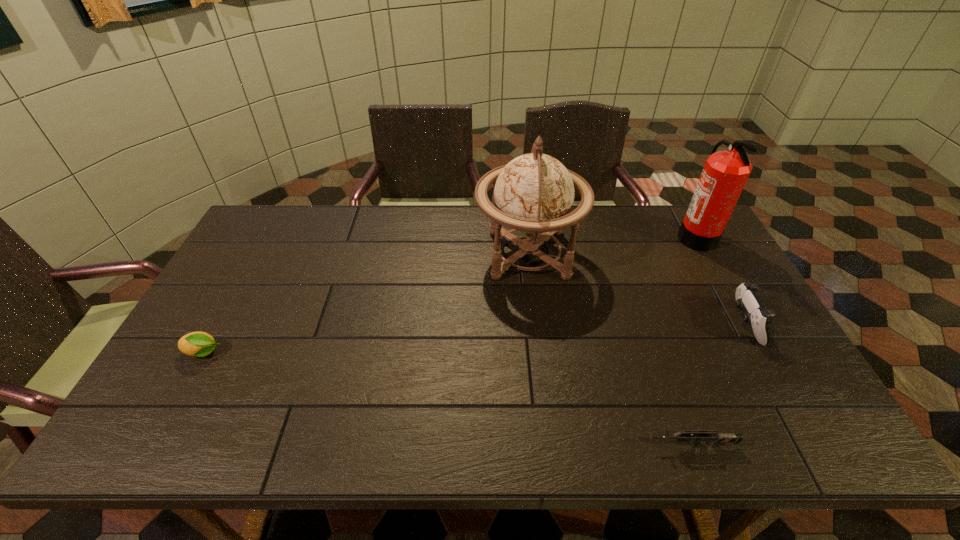
Identify the location of globe at the far edge. (534, 193).

This screenshot has width=960, height=540. Find the location of `fire extinguisher positioned at the far edge`. fire extinguisher positioned at the far edge is located at coordinates (725, 173).

Where is `object that is at the near edge`? object that is at the near edge is located at coordinates (717, 438).

You are a GUI agent. You are given a task and a screenshot of the screen. Output one action in this format:
    pyautogui.click(x=<x>, y=<y>)
    Task: Click on the object at the left edge
    The height and width of the screenshot is (540, 960).
    Given the screenshot: What is the action you would take?
    pyautogui.click(x=200, y=344)

Identify the location of fire extinguisher at the right edge. (725, 173).

At what (x,y) coordinates should I click in order to perform the action: click on control that is at the right edge. Please return your answer as a coordinate pair (x, y). Looking at the image, I should click on (747, 299).

The width and height of the screenshot is (960, 540). What are the coordinates of `object that is at the far right corner` in the screenshot? It's located at (725, 173).

Find the location of a particular element. The height and width of the screenshot is (540, 960). vacant space at the far edge is located at coordinates (341, 205).

Identify the location of free location at the near edge. (213, 421).

Locate an element on the screen. The height and width of the screenshot is (540, 960). free region at the right edge of the desktop is located at coordinates (730, 295).